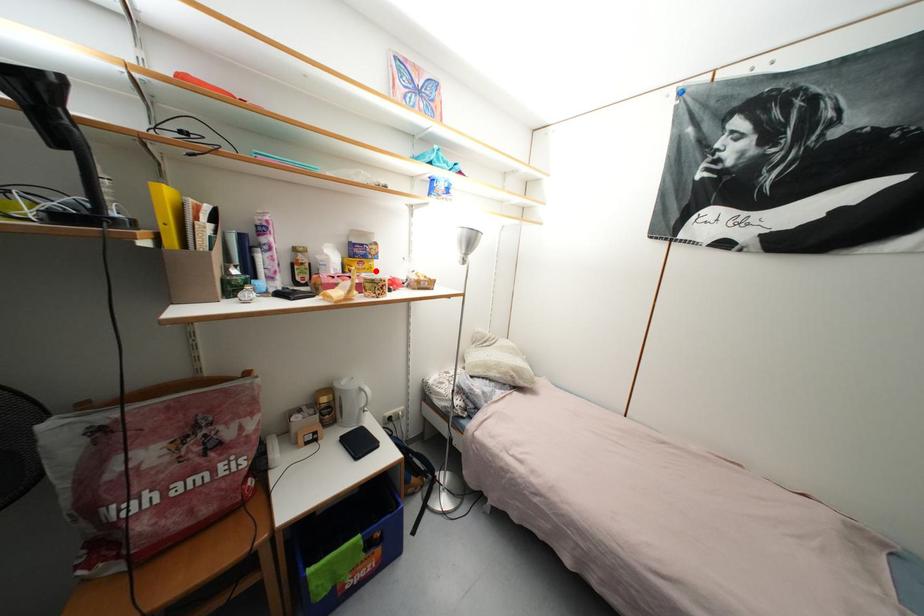
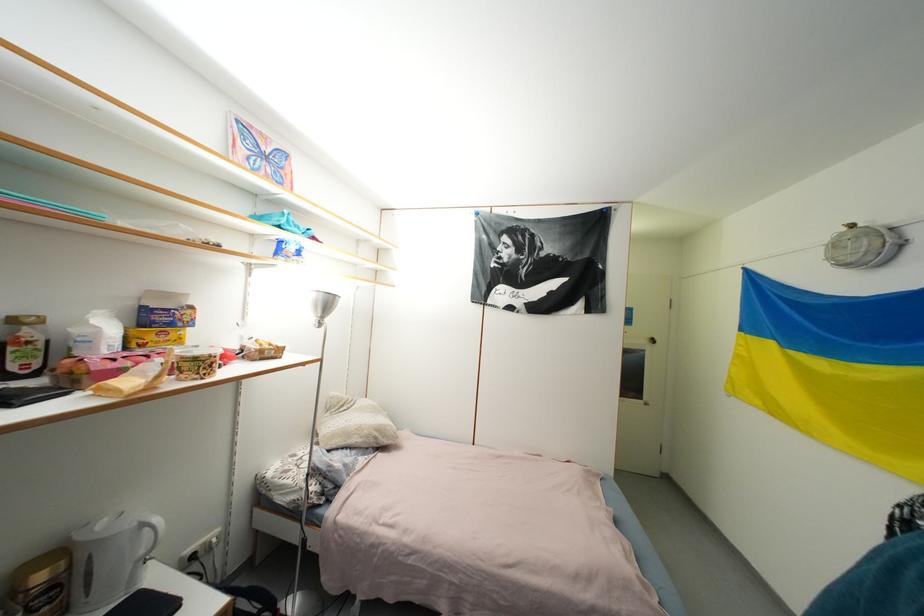
Question: I am providing you with two images of the same scene from different viewpoints. A red point is marked on the first image. At the location where the point appears in image 1, is it still visible in image 2?

Choices:
 (A) Yes
 (B) No

Answer: (A)